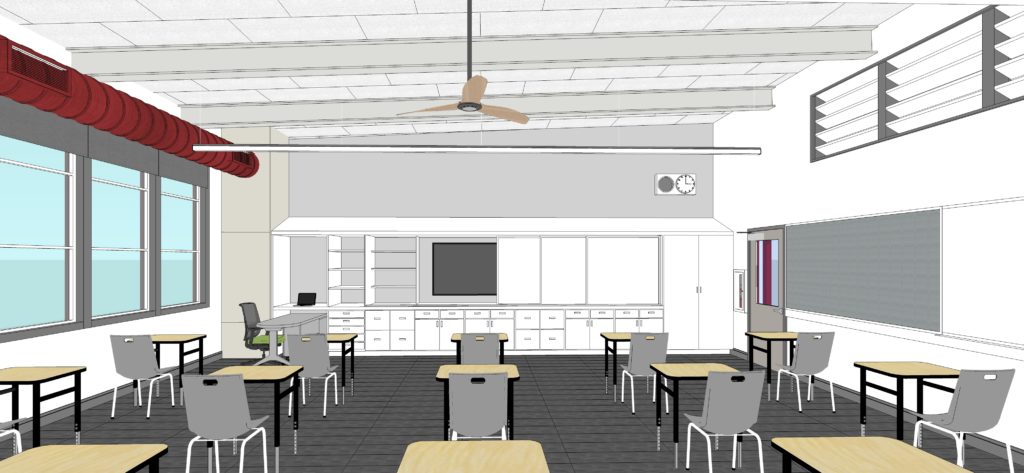
Mark all positions containing where i'd grab the chair in the image. Your answer should be formatted as a list of tuples, i.e. [(x1, y1), (x2, y2), ...], where each tuple contains the x and y coordinates of a point satisfying the conditions above.

[(209, 380), (482, 379), (738, 378), (991, 374), (818, 336)]